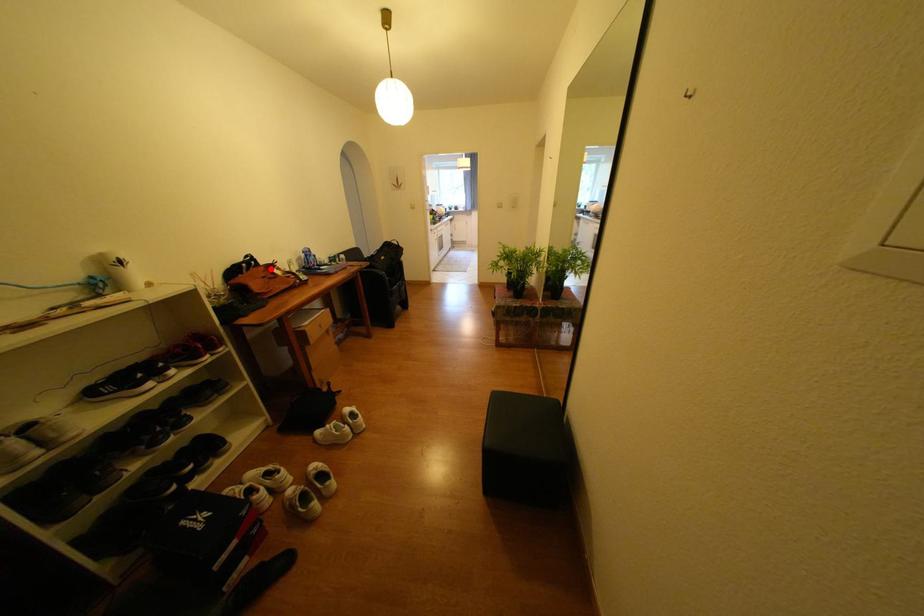
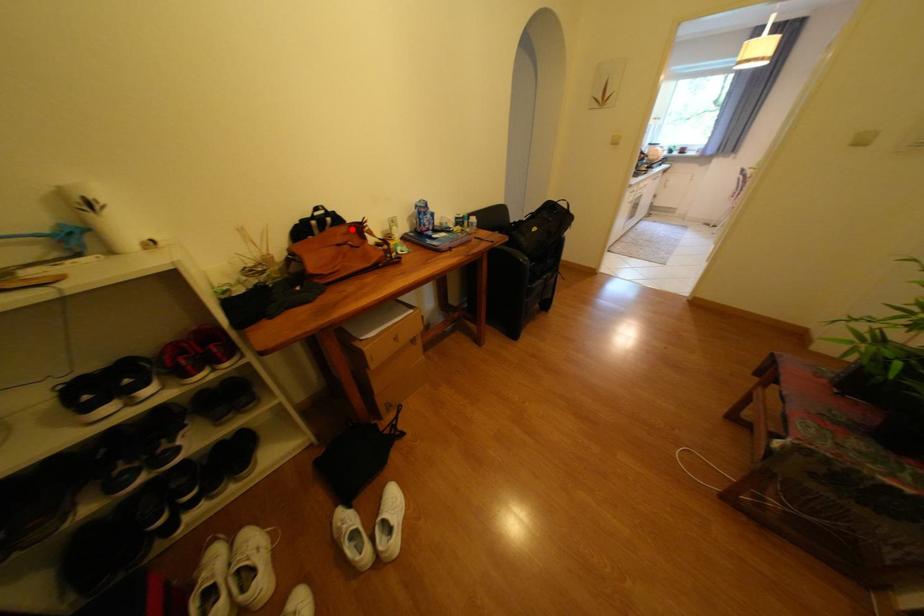
I am providing you with two images of the same scene from different viewpoints. A red point is marked on the first image and another point is marked on the second image. Does the point marked in image1 correspond to the same location as the one in image2?

Yes